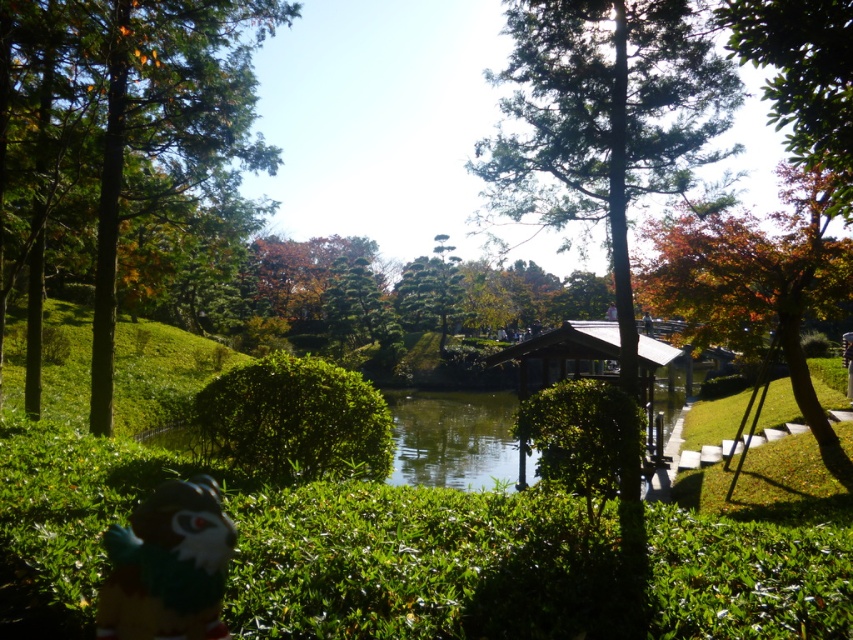
Question: Does green leafy tree at upper right lie behind green textured pine tree at center?

Choices:
 (A) no
 (B) yes

Answer: (A)

Question: Is the position of green leafy tree at upper right less distant than that of green textured pine tree at center?

Choices:
 (A) no
 (B) yes

Answer: (B)

Question: Which is farther from the green textured pine tree at center?

Choices:
 (A) green textured tree at center
 (B) green leafy tree at upper right
 (C) green leafy bush at center

Answer: (B)

Question: Which of the following is the farthest from the observer?

Choices:
 (A) (825, 129)
 (B) (561, 104)

Answer: (B)

Question: Is green leafy bush at center further to camera compared to green textured pine tree at center?

Choices:
 (A) yes
 (B) no

Answer: (B)

Question: Among these points, which one is farthest from the camera?

Choices:
 (A) (844, 195)
 (B) (442, 292)
 (C) (3, 88)

Answer: (B)